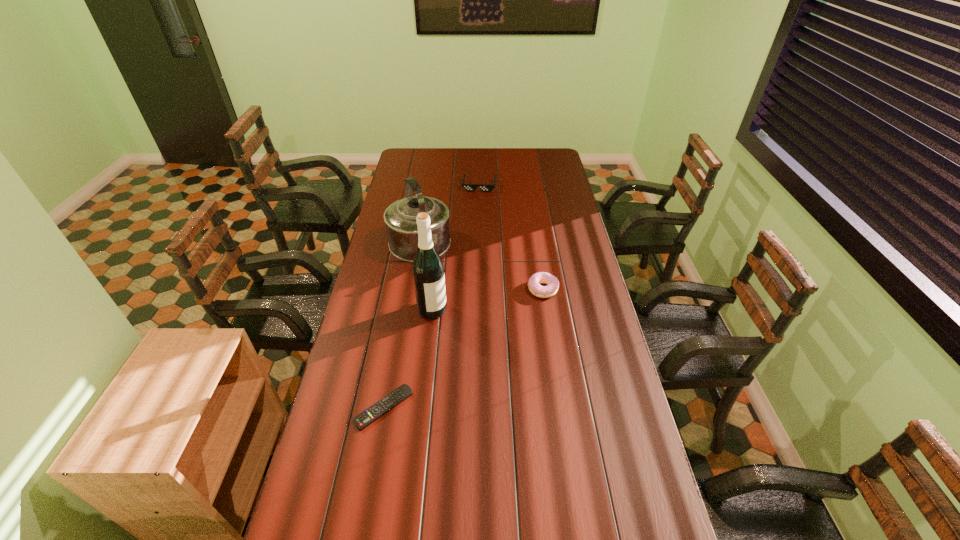
The image size is (960, 540). In order to click on free space between the nearest object and the rightmost object in this screenshot , I will do `click(463, 348)`.

The width and height of the screenshot is (960, 540). I want to click on free spot between the kettle and the nearest object, so click(x=401, y=327).

Where is `vacant area that lies between the doughnut and the sunglasses`? The height and width of the screenshot is (540, 960). vacant area that lies between the doughnut and the sunglasses is located at coordinates (511, 237).

What are the coordinates of `vacant region between the kettle and the remote control` in the screenshot? It's located at (401, 327).

Locate an element on the screen. Image resolution: width=960 pixels, height=540 pixels. free point between the rightmost object and the nearest object is located at coordinates (463, 348).

Where is `object that can be found as the closest to the second object from right to left`? Image resolution: width=960 pixels, height=540 pixels. object that can be found as the closest to the second object from right to left is located at coordinates (400, 217).

Where is `the closest object relative to the tallest object`? The height and width of the screenshot is (540, 960). the closest object relative to the tallest object is located at coordinates (400, 217).

This screenshot has width=960, height=540. Find the location of `free space in the image that satisfies the following two spatial constraints: 1. on the back side of the fourth object from left to right; 2. on the right side of the fourth nearest object`. free space in the image that satisfies the following two spatial constraints: 1. on the back side of the fourth object from left to right; 2. on the right side of the fourth nearest object is located at coordinates point(429,186).

You are a GUI agent. You are given a task and a screenshot of the screen. Output one action in this format:
    pyautogui.click(x=<x>, y=<y>)
    Task: Click on the free region that satisfies the following two spatial constraints: 1. on the back side of the wine bottle; 2. on the right side of the nearest object
    
    Given the screenshot: What is the action you would take?
    pyautogui.click(x=401, y=309)

The height and width of the screenshot is (540, 960). Find the location of `vacant area that satisfies the following two spatial constraints: 1. on the back side of the sunglasses; 2. on the right side of the fourth shortest object`. vacant area that satisfies the following two spatial constraints: 1. on the back side of the sunglasses; 2. on the right side of the fourth shortest object is located at coordinates (429, 186).